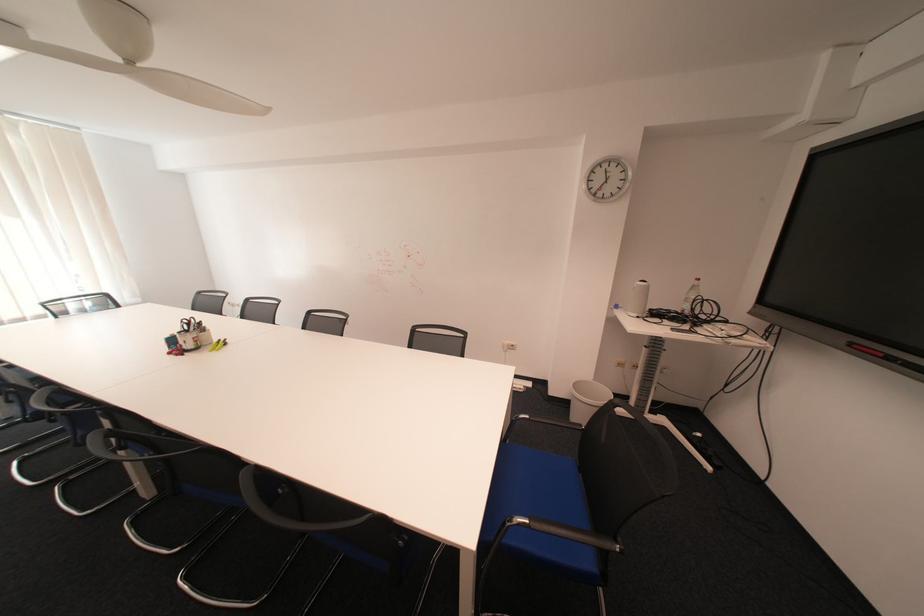
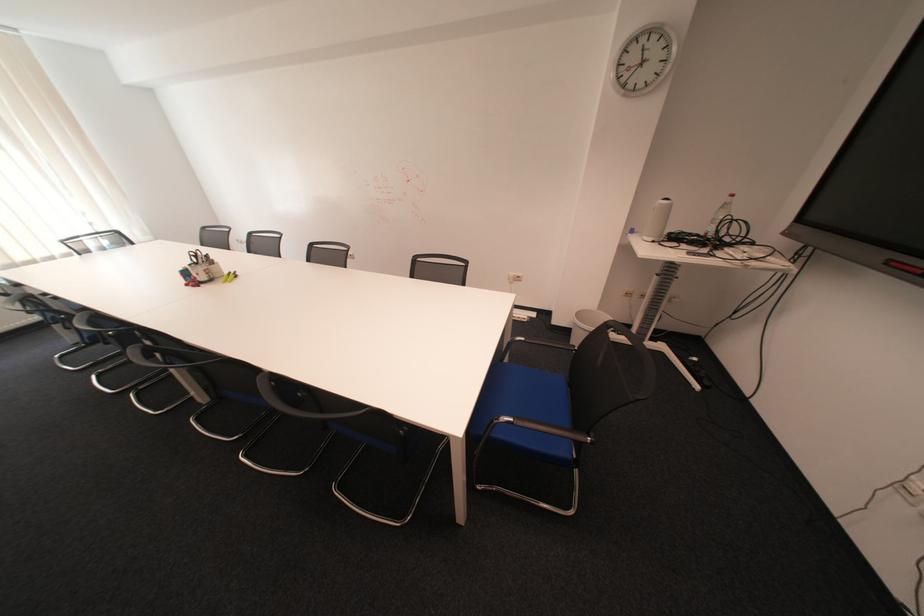
Locate, in the second image, the point that corresponds to [627,307] in the first image.

(643, 232)